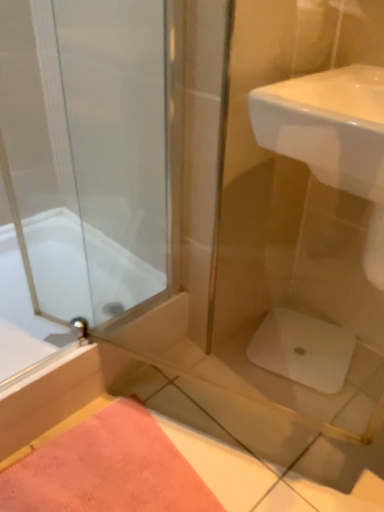
The image size is (384, 512). What do you see at coordinates (107, 469) in the screenshot?
I see `pink fabric bath mat at lower left` at bounding box center [107, 469].

I want to click on white glossy bathtub at left, so click(59, 263).

Locate an element on the screen. pink fabric bath mat at lower left is located at coordinates (107, 469).

Is pink fabric bath mat at lower left looking in the opposite direction of white glossy sink at upper right?

pink fabric bath mat at lower left is not turned away from white glossy sink at upper right.

Considering the relative positions of pink fabric bath mat at lower left and white glossy sink at upper right in the image provided, is pink fabric bath mat at lower left to the left of white glossy sink at upper right from the viewer's perspective?

Yes.

Considering the relative sizes of pink fabric bath mat at lower left and white glossy sink at upper right in the image provided, is pink fabric bath mat at lower left taller than white glossy sink at upper right?

Incorrect, the height of pink fabric bath mat at lower left is not larger of that of white glossy sink at upper right.

Is pink fabric bath mat at lower left inside the boundaries of white glossy sink at upper right, or outside?

pink fabric bath mat at lower left is outside white glossy sink at upper right.

Between white glossy sink at upper right and white glossy bathtub at left, which one has smaller size?

white glossy sink at upper right is smaller.

Is there a large distance between white glossy sink at upper right and white glossy bathtub at left?

white glossy sink at upper right is near white glossy bathtub at left, not far away.

From the image's perspective, who appears lower, white glossy sink at upper right or white glossy bathtub at left?

white glossy bathtub at left is shown below in the image.

Consider the image. Would you consider white glossy bathtub at left to be distant from pink fabric bath mat at lower left?

No, white glossy bathtub at left is not far from pink fabric bath mat at lower left.

Does white glossy bathtub at left appear on the left side of pink fabric bath mat at lower left?

Indeed, white glossy bathtub at left is positioned on the left side of pink fabric bath mat at lower left.

Which object is wider, white glossy bathtub at left or pink fabric bath mat at lower left?

white glossy bathtub at left is wider.

From a real-world perspective, which object stands above the other?

white glossy bathtub at left, from a real-world perspective.

Can you confirm if pink fabric bath mat at lower left is smaller than white glossy bathtub at left?

Yes, pink fabric bath mat at lower left is smaller than white glossy bathtub at left.

Is pink fabric bath mat at lower left at the left side of white glossy bathtub at left?

In fact, pink fabric bath mat at lower left is to the right of white glossy bathtub at left.

How many degrees apart are the facing directions of pink fabric bath mat at lower left and white glossy bathtub at left?

1.24 degrees separate the facing orientations of pink fabric bath mat at lower left and white glossy bathtub at left.

Is pink fabric bath mat at lower left looking in the opposite direction of white glossy bathtub at left?

pink fabric bath mat at lower left is not turned away from white glossy bathtub at left.

Considering the points (285, 147) and (161, 481), which point is behind, point (285, 147) or point (161, 481)?

Point (161, 481)

Which of these two, white glossy sink at upper right or pink fabric bath mat at lower left, stands taller?

With more height is white glossy sink at upper right.

Choose the correct answer: Is white glossy sink at upper right inside pink fabric bath mat at lower left or outside it?

white glossy sink at upper right is not inside pink fabric bath mat at lower left, it's outside.

Can you tell me how much white glossy sink at upper right and pink fabric bath mat at lower left differ in facing direction?

The facing directions of white glossy sink at upper right and pink fabric bath mat at lower left are 88.2 degrees apart.

Considering the relative sizes of white glossy bathtub at left and white glossy sink at upper right in the image provided, is white glossy bathtub at left taller than white glossy sink at upper right?

No.

Is point (127, 250) farther from viewer compared to point (302, 115)?

Yes.

How far apart are white glossy bathtub at left and white glossy sink at upper right?

The distance of white glossy bathtub at left from white glossy sink at upper right is 32.80 inches.

Is white glossy bathtub at left smaller than white glossy sink at upper right?

No, white glossy bathtub at left is not smaller than white glossy sink at upper right.

You are a GUI agent. You are given a task and a screenshot of the screen. Output one action in this format:
    pyautogui.click(x=<x>, y=<y>)
    Task: Click on the bath mat that is behind the white glossy sink at upper right
    
    Given the screenshot: What is the action you would take?
    pyautogui.click(x=107, y=469)

You are a GUI agent. You are given a task and a screenshot of the screen. Output one action in this format:
    pyautogui.click(x=<x>, y=<y>)
    Task: Click on the sink that is on the right side of white glossy bathtub at left
    
    Given the screenshot: What is the action you would take?
    (328, 126)

Which object lies nearer to the anchor point white glossy sink at upper right, white glossy bathtub at left or pink fabric bath mat at lower left?

white glossy bathtub at left lies closer to white glossy sink at upper right than the other object.

Based on their spatial positions, is pink fabric bath mat at lower left or white glossy bathtub at left closer to white glossy sink at upper right?

white glossy bathtub at left.

Based on their spatial positions, is pink fabric bath mat at lower left or white glossy sink at upper right further from white glossy bathtub at left?

white glossy sink at upper right is further to white glossy bathtub at left.

Estimate the real-world distances between objects in this image. Which object is closer to white glossy bathtub at left, white glossy sink at upper right or pink fabric bath mat at lower left?

Among the two, pink fabric bath mat at lower left is located nearer to white glossy bathtub at left.

Estimate the real-world distances between objects in this image. Which object is further from pink fabric bath mat at lower left, white glossy bathtub at left or white glossy sink at upper right?

Among the two, white glossy sink at upper right is located further to pink fabric bath mat at lower left.

Based on their spatial positions, is white glossy sink at upper right or white glossy bathtub at left closer to pink fabric bath mat at lower left?

white glossy bathtub at left is closer to pink fabric bath mat at lower left.

Locate an element on the screen. Image resolution: width=384 pixels, height=512 pixels. bath mat located between white glossy bathtub at left and white glossy sink at upper right in the left-right direction is located at coordinates (107, 469).